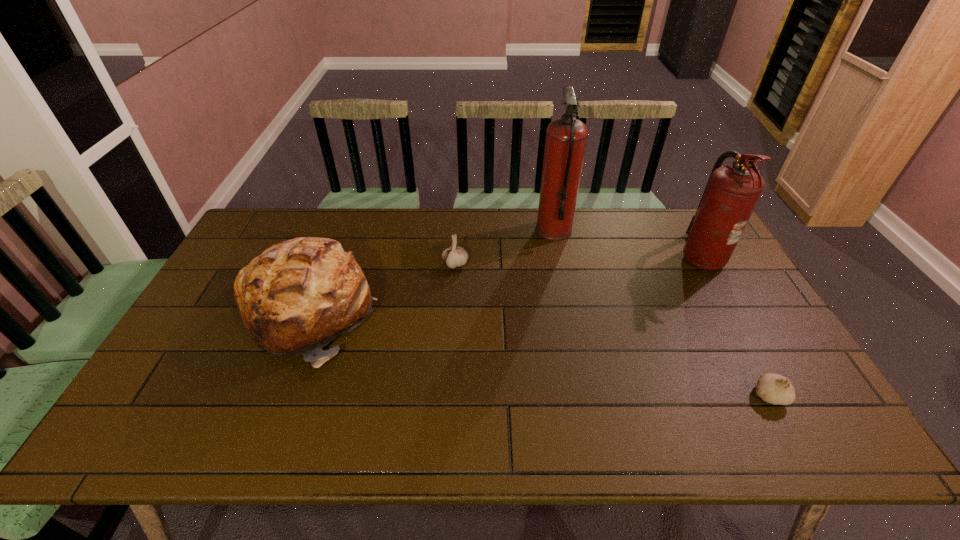
In order to click on garlic at the right edge in this screenshot , I will do `click(775, 389)`.

Where is `object located in the far right corner section of the desktop`? object located in the far right corner section of the desktop is located at coordinates (732, 192).

Locate an element on the screen. The height and width of the screenshot is (540, 960). blank space at the far edge of the desktop is located at coordinates tap(577, 210).

The width and height of the screenshot is (960, 540). I want to click on vacant space at the near edge of the desktop, so click(x=250, y=431).

Where is `vacant area at the left edge of the desktop`? This screenshot has width=960, height=540. vacant area at the left edge of the desktop is located at coordinates (x=234, y=266).

Locate an element on the screen. The width and height of the screenshot is (960, 540). blank space at the right edge of the desktop is located at coordinates (805, 407).

Where is `vacant space at the far left corner of the desktop`? The width and height of the screenshot is (960, 540). vacant space at the far left corner of the desktop is located at coordinates (258, 219).

The height and width of the screenshot is (540, 960). Find the location of `vacant space at the far right corner of the desktop`. vacant space at the far right corner of the desktop is located at coordinates (685, 223).

Where is `vacant space that is in between the leftmost object and the third object from left to right`? vacant space that is in between the leftmost object and the third object from left to right is located at coordinates (431, 272).

This screenshot has width=960, height=540. Identify the location of vacant area that lies between the nearer garlic and the leftmost object. (539, 355).